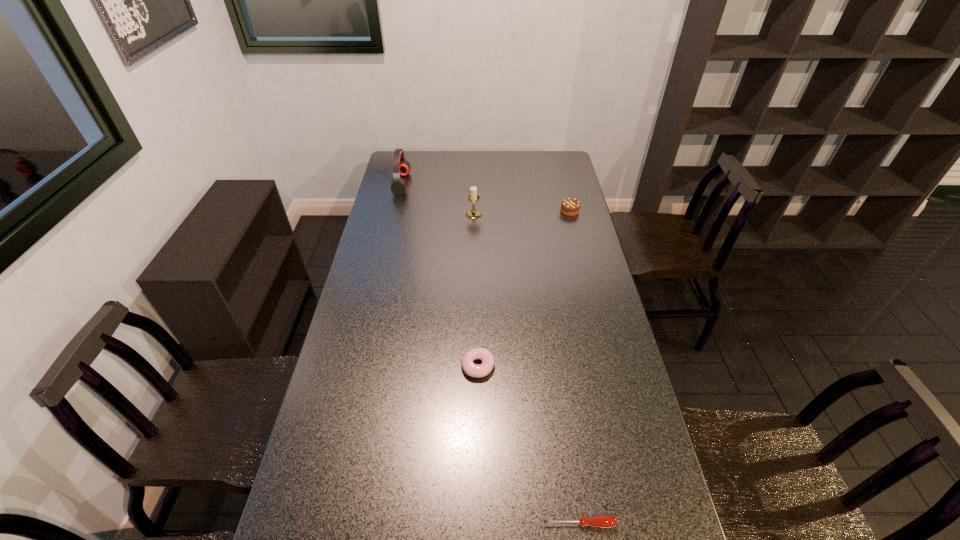
Find the location of a particular element. blank space that satisfies the following two spatial constraints: 1. on the front side of the second shortest object; 2. on the right side of the candle holder is located at coordinates (471, 367).